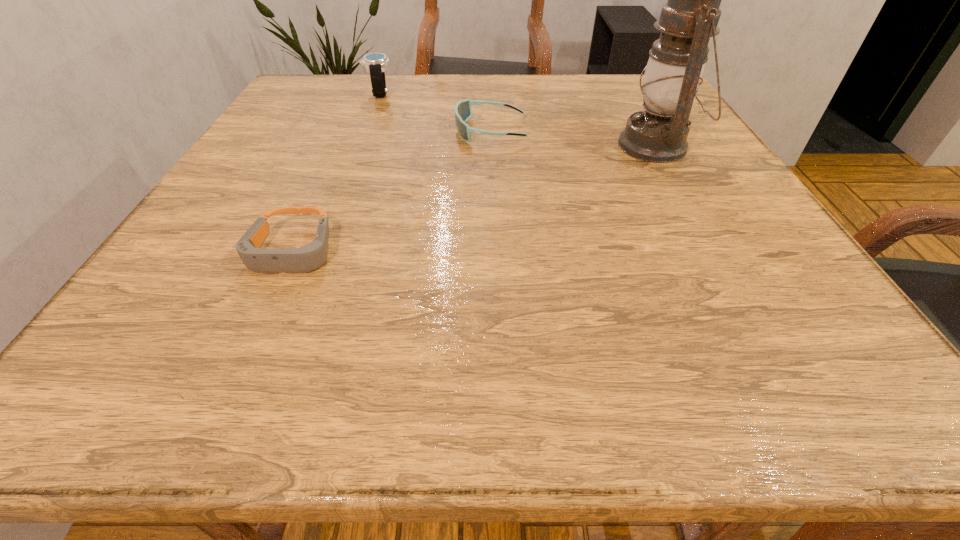
This screenshot has width=960, height=540. Find the location of `vacant space located 0.080m on the front-facing side of the right goggles`. vacant space located 0.080m on the front-facing side of the right goggles is located at coordinates (419, 131).

The image size is (960, 540). Identify the location of vacant area situated on the front-facing side of the right goggles. (383, 131).

This screenshot has height=540, width=960. I want to click on free space located 0.220m on the front-facing side of the right goggles, so click(356, 131).

You are a GUI agent. You are given a task and a screenshot of the screen. Output one action in this format:
    pyautogui.click(x=<x>, y=<y>)
    Task: Click on the vacant space situated on the front and back of the shorter goggles
    Image resolution: width=960 pixels, height=540 pixels.
    Given the screenshot: What is the action you would take?
    pyautogui.click(x=235, y=379)

What are the coordinates of `object that is at the far edge` in the screenshot? It's located at (375, 63).

Image resolution: width=960 pixels, height=540 pixels. I want to click on object that is positioned at the left edge, so click(x=311, y=256).

Identify the location of object located at the right edge. (658, 134).

This screenshot has height=540, width=960. In the image, there is a desktop. In order to click on vacant space at the far edge in this screenshot , I will do `click(489, 73)`.

Find the location of a particular element. free point at the near edge is located at coordinates (410, 362).

This screenshot has width=960, height=540. I want to click on vacant region at the left edge of the desktop, so click(x=283, y=197).